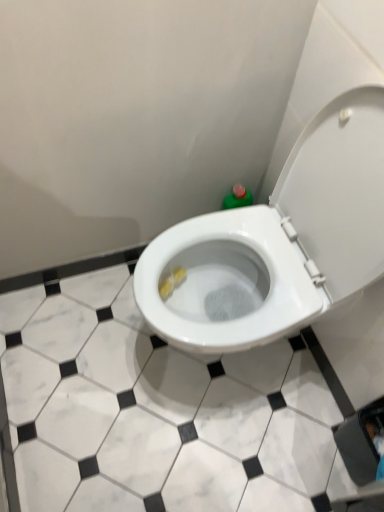
This screenshot has height=512, width=384. I want to click on white glossy tile at center, so click(173, 403).

What do you see at coordinates (173, 403) in the screenshot? I see `white glossy tile at center` at bounding box center [173, 403].

Find the location of a particular element. This screenshot has width=384, height=512. white glossy toilet at center is located at coordinates (279, 241).

Consider the image. What is the approximate width of white glossy toilet at center?

The width of white glossy toilet at center is 20.87 inches.

What do you see at coordinates (279, 241) in the screenshot? I see `white glossy toilet at center` at bounding box center [279, 241].

In order to face white glossy toilet at center, should I rotate leftwards or rightwards?

Rotate right and turn 6.568 degrees.

Where is `white glossy tile at center`? Image resolution: width=384 pixels, height=512 pixels. white glossy tile at center is located at coordinates (173, 403).

Based on their positions, is white glossy toilet at center located to the left or right of white glossy tile at center?

In the image, white glossy toilet at center appears on the right side of white glossy tile at center.

Is white glossy toilet at center positioned in front of white glossy tile at center?

Yes, it is.

Which point is more distant from viewer, (322, 221) or (329, 459)?

The point (329, 459) is farther from the camera.

From the image's perspective, is white glossy toilet at center on top of white glossy tile at center?

Indeed, from the image's perspective, white glossy toilet at center is shown above white glossy tile at center.

From a real-world perspective, is white glossy toilet at center physically below white glossy tile at center?

No, from a real-world perspective, white glossy toilet at center is not below white glossy tile at center.

Is white glossy toilet at center thinner than white glossy tile at center?

Correct, the width of white glossy toilet at center is less than that of white glossy tile at center.

Looking at this image, considering the relative sizes of white glossy toilet at center and white glossy tile at center in the image provided, is white glossy toilet at center taller than white glossy tile at center?

Yes, white glossy toilet at center is taller than white glossy tile at center.

Considering the sizes of objects white glossy toilet at center and white glossy tile at center in the image provided, who is smaller, white glossy toilet at center or white glossy tile at center?

Smaller between the two is white glossy tile at center.

Is white glossy toilet at center located outside white glossy tile at center?

Yes, white glossy toilet at center is not within white glossy tile at center.

Are white glossy toilet at center and white glossy tile at center far apart?

No.

Is white glossy tile at center at the back of white glossy toilet at center?

No, white glossy toilet at center is not facing the opposite direction of white glossy tile at center.

How different are the orientations of white glossy toilet at center and white glossy tile at center in degrees?

white glossy toilet at center and white glossy tile at center are facing 89 degrees away from each other.

How distant is white glossy toilet at center from white glossy tile at center?

A distance of 33.19 centimeters exists between white glossy toilet at center and white glossy tile at center.

Locate an element on the screen. toilet in front of the white glossy tile at center is located at coordinates (279, 241).

Based on their positions, is white glossy tile at center located to the left or right of white glossy toilet at center?

Based on their positions, white glossy tile at center is located to the left of white glossy toilet at center.

Considering the positions of objects white glossy tile at center and white glossy toilet at center in the image provided, who is behind, white glossy tile at center or white glossy toilet at center?

white glossy tile at center is more distant.

Which is nearer, [128,254] or [352,135]?

Positioned in front is point [352,135].

From the image's perspective, is white glossy tile at center on top of white glossy toilet at center?

No, from the image's perspective, white glossy tile at center is not on top of white glossy toilet at center.

From a real-world perspective, is white glossy tile at center on white glossy toilet at center?

No, from a real-world perspective, white glossy tile at center is not over white glossy toilet at center

Can you confirm if white glossy tile at center is thinner than white glossy toilet at center?

No.

Consider the image. Considering the relative sizes of white glossy tile at center and white glossy toilet at center in the image provided, is white glossy tile at center shorter than white glossy toilet at center?

Yes, white glossy tile at center is shorter than white glossy toilet at center.

Which of these two, white glossy tile at center or white glossy toilet at center, is bigger?

white glossy toilet at center is bigger.

Consider the image. Can we say white glossy tile at center lies outside white glossy toilet at center?

Yes.

Would you say white glossy tile at center is a long distance from white glossy toilet at center?

They are positioned close to each other.

Is white glossy tile at center facing towards white glossy toilet at center?

No.

Looking at this image, can you tell me how much white glossy tile at center and white glossy toilet at center differ in facing direction?

The angle between the facing direction of white glossy tile at center and the facing direction of white glossy toilet at center is 89 degrees.

Locate an element on the screen. tile below the white glossy toilet at center (from a real-world perspective) is located at coordinates (173, 403).

Locate an element on the screen. Image resolution: width=384 pixels, height=512 pixels. toilet above the white glossy tile at center (from the image's perspective) is located at coordinates (279, 241).

Where is `tile lying behind the white glossy toilet at center`? Image resolution: width=384 pixels, height=512 pixels. tile lying behind the white glossy toilet at center is located at coordinates (173, 403).